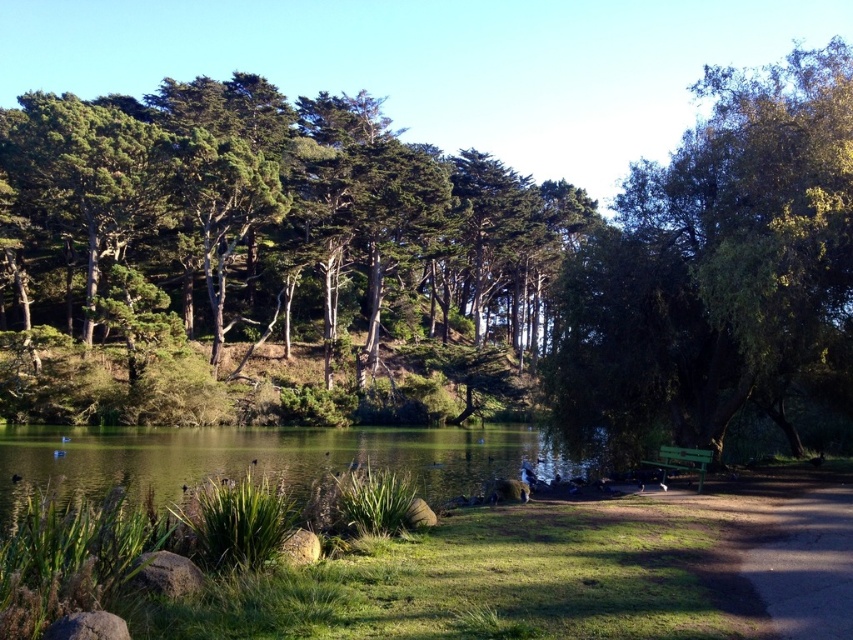
Between point (479, 433) and point (798, 605), which one is positioned in front?

Positioned in front is point (798, 605).

Is green reflective water at center to the right of dirt/gravel path at lower right from the viewer's perspective?

No, green reflective water at center is not to the right of dirt/gravel path at lower right.

Who is more forward, [421,470] or [767,582]?

Point [767,582] is more forward.

Where is `green reflective water at center`? The image size is (853, 640). green reflective water at center is located at coordinates (260, 458).

Is green textured trees at upper left taller than green leafy tree at right?

Indeed, green textured trees at upper left has a greater height compared to green leafy tree at right.

Can you confirm if green textured trees at upper left is positioned to the right of green leafy tree at right?

Incorrect, green textured trees at upper left is not on the right side of green leafy tree at right.

At what (x,y) coordinates should I click in order to perform the action: click on green textured trees at upper left. Please return your answer as a coordinate pair (x, y). Looking at the image, I should click on (268, 212).

Does dirt/gravel path at lower right have a larger size compared to green painted wood bench at lower right?

Yes.

Locate an element on the screen. dirt/gravel path at lower right is located at coordinates (805, 564).